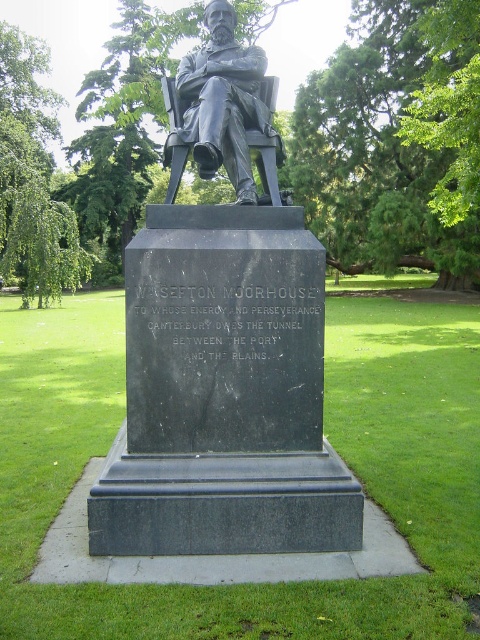
You are a park visitor who wants to take a photo of both the black marble statue at center and the bronze statue at center. Since you can only take one photo, where should you position yourself so that both statues are visible in the frame?

You should position yourself to the right of the black marble statue at center and to the left of the bronze statue at center so that both are visible in the frame.

You are a park visitor standing in front of the two statues. Which statue, the black marble statue at center or the bronze statue at center, is closer to you?

The black marble statue at center is closer to you since it is in front of the bronze statue at center.